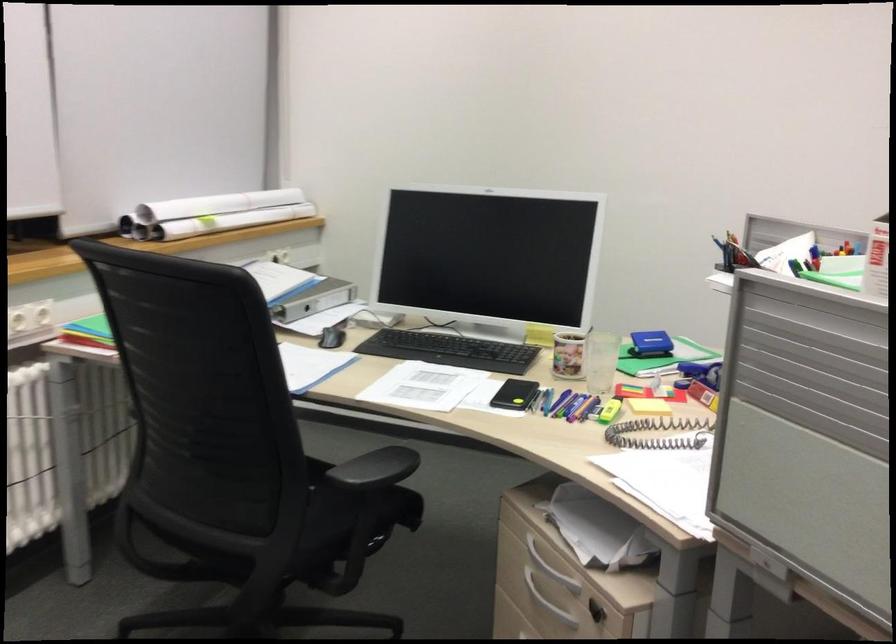
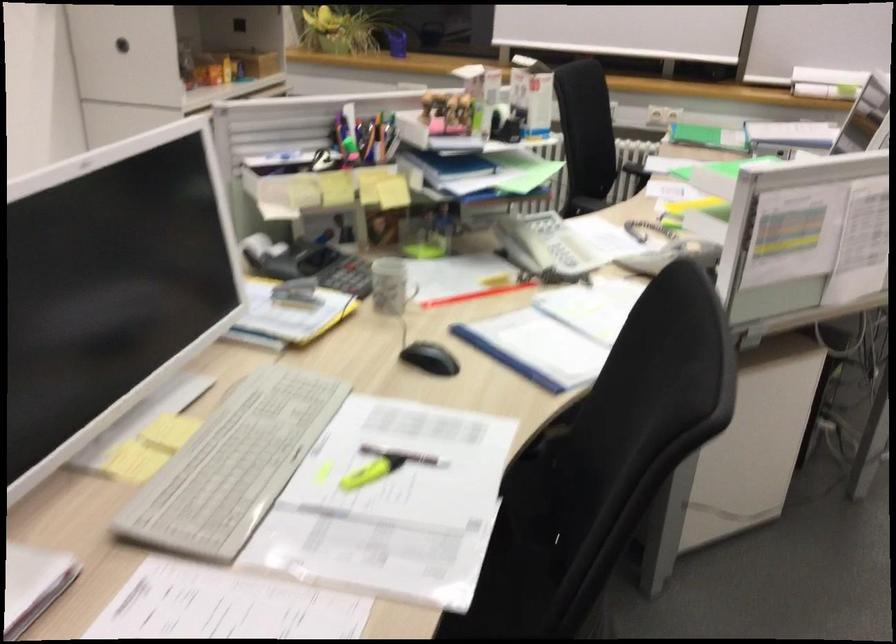
Question: I am providing you with two images of the same scene from different viewpoints. Which of the following objects are not visible in image2?

Choices:
 (A) glass kettle handle
 (B) black chair armrest
 (C) white telephone handset
 (D) clear drinking glass

Answer: (D)